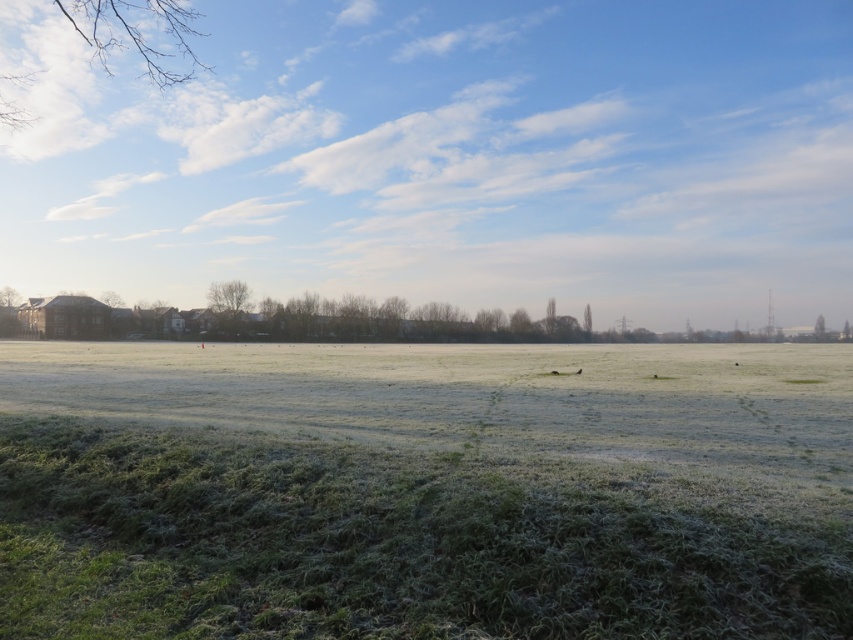
You are an artist sketching the scene and want to draw the bare branches at upper left and the green matte tree at right. Which one should you draw first if you follow a left to right direction?

You should draw the bare branches at upper left first since it is positioned to the left of the green matte tree at right.

You are standing in the middle of the grassy field and see the green matte tree at left and the green matte tree at right. Which tree is closer to your left side?

The green matte tree at left is closer to your left side because it is positioned to the left of the green matte tree at right.